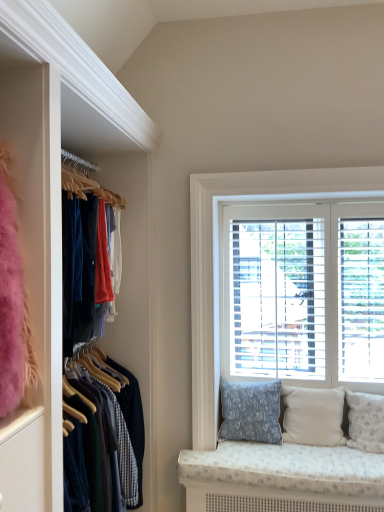
Question: Is white wood blinds at upper right situated inside white fabric pillow at lower right, acting as the first pillow starting from the right, or outside?

Choices:
 (A) inside
 (B) outside

Answer: (B)

Question: Considering the positions of point [x=329, y=180] and point [x=362, y=394], is point [x=329, y=180] closer or farther from the camera than point [x=362, y=394]?

Choices:
 (A) closer
 (B) farther

Answer: (A)

Question: Considering the real-world distances, which object is farthest from the beige fabric pillow at lower right, placed as the 2th pillow when sorted from left to right?

Choices:
 (A) white wood blinds at upper right
 (B) blue floral fabric pillow at lower right, marked as the first pillow in a left-to-right arrangement
 (C) white fabric pillow at lower right, positioned as the 3th pillow in left-to-right order

Answer: (A)

Question: Which object is the closest to the blue floral fabric pillow at lower right, which is counted as the 3th pillow, starting from the right?

Choices:
 (A) beige fabric pillow at lower right, placed as the 2th pillow when sorted from left to right
 (B) white wood blinds at upper right
 (C) white fabric pillow at lower right, positioned as the 3th pillow in left-to-right order

Answer: (A)